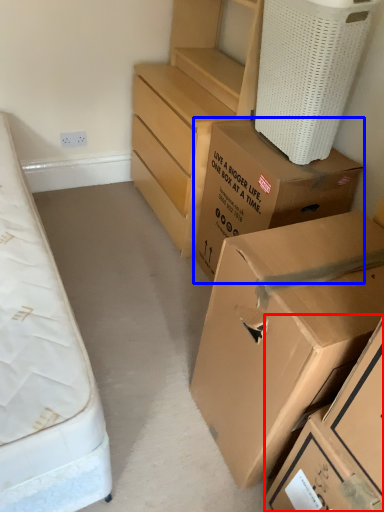
Question: Which object appears closest to the camera in this image, box (highlighted by a red box) or box (highlighted by a blue box)?

Choices:
 (A) box
 (B) box

Answer: (A)